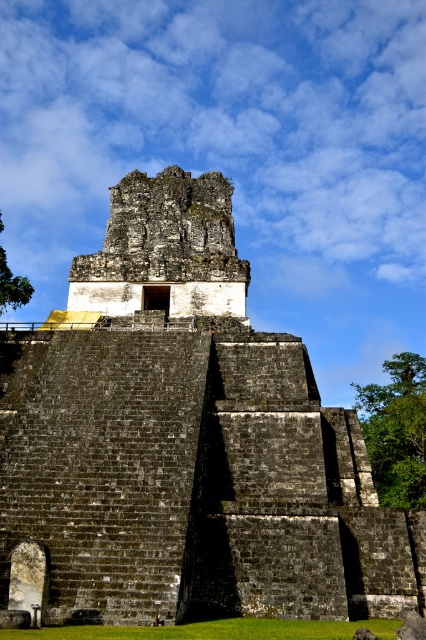
Question: Is dark gray stone ruins at center to the left of rough stone tower at center from the viewer's perspective?

Choices:
 (A) yes
 (B) no

Answer: (B)

Question: Which point appears farthest from the camera in this image?

Choices:
 (A) click(106, 300)
 (B) click(261, 545)

Answer: (A)

Question: Does dark gray stone ruins at center have a lesser width compared to rough stone tower at center?

Choices:
 (A) no
 (B) yes

Answer: (A)

Question: Can you confirm if dark gray stone ruins at center is smaller than rough stone tower at center?

Choices:
 (A) yes
 (B) no

Answer: (B)

Question: Among these objects, which one is nearest to the camera?

Choices:
 (A) rough stone tower at center
 (B) dark gray stone ruins at center

Answer: (B)